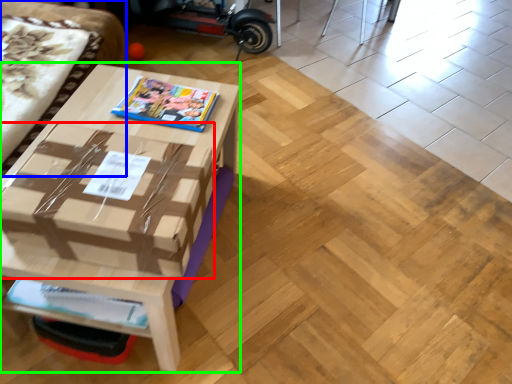
Question: Based on their relative distances, which object is farther from cardboard box (highlighted by a red box)? Choose from couch (highlighted by a blue box) and table (highlighted by a green box).

Choices:
 (A) couch
 (B) table

Answer: (A)